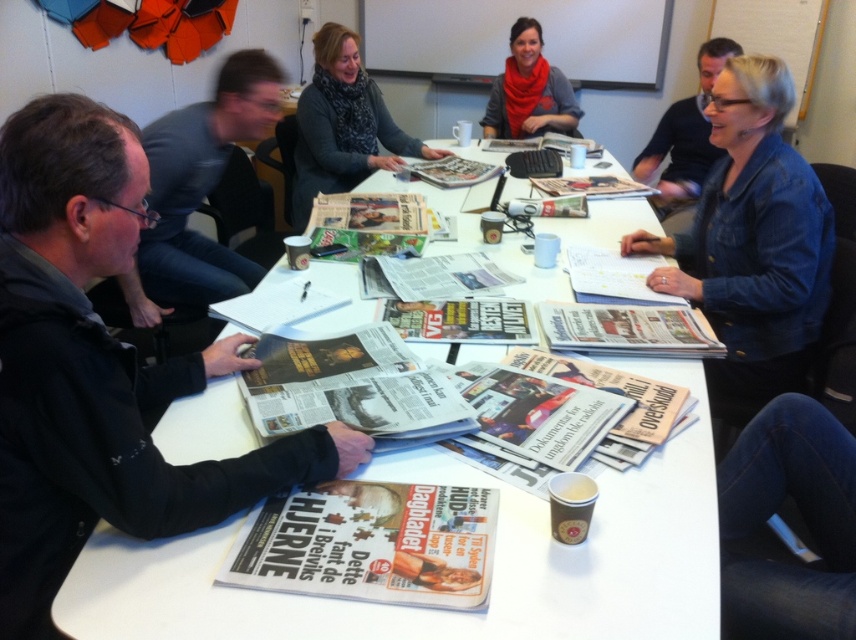
Which is more to the left, black fabric jacket at lower left or denim jacket at upper right?

black fabric jacket at lower left

Is point (16, 256) positioned behind point (785, 189)?

No, (16, 256) is closer to viewer.

The height and width of the screenshot is (640, 856). Find the location of `black fabric jacket at lower left`. black fabric jacket at lower left is located at coordinates (99, 369).

Can you confirm if black fabric jacket at lower left is smaller than knitted scarf at upper center?

Indeed, black fabric jacket at lower left has a smaller size compared to knitted scarf at upper center.

Where is `black fabric jacket at lower left`? The height and width of the screenshot is (640, 856). black fabric jacket at lower left is located at coordinates (99, 369).

Where is `black fabric jacket at lower left`? This screenshot has height=640, width=856. black fabric jacket at lower left is located at coordinates (99, 369).

Is black fabric jacket at lower left to the right of denim jeans at lower right from the viewer's perspective?

In fact, black fabric jacket at lower left is to the left of denim jeans at lower right.

What do you see at coordinates (99, 369) in the screenshot? I see `black fabric jacket at lower left` at bounding box center [99, 369].

At what (x,y) coordinates should I click in order to perform the action: click on black fabric jacket at lower left. Please return your answer as a coordinate pair (x, y). This screenshot has height=640, width=856. Looking at the image, I should click on (99, 369).